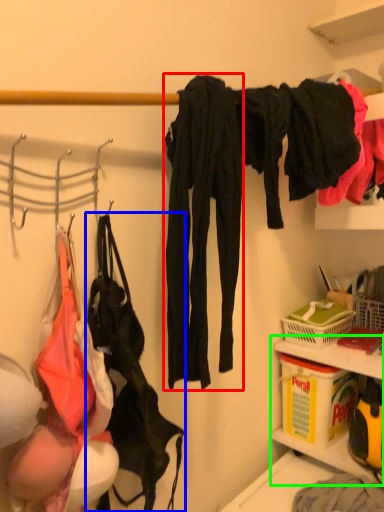
Question: Considering the real-world distances, which object is farthest from clothing (highlighted by a red box)? handbag (highlighted by a blue box) or cabinet (highlighted by a green box)?

Choices:
 (A) handbag
 (B) cabinet

Answer: (B)